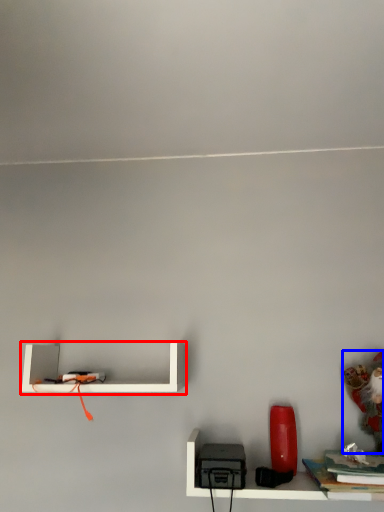
Question: Which object is further to the camera taking this photo, shelf (highlighted by a red box) or toy (highlighted by a blue box)?

Choices:
 (A) shelf
 (B) toy

Answer: (A)